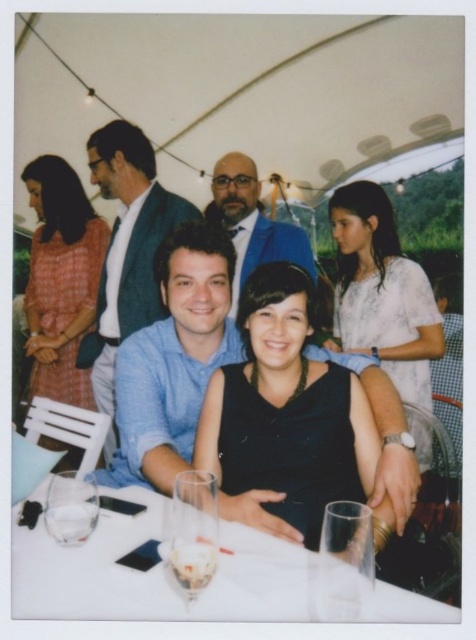
Question: Is clear glassware at center further to the viewer compared to clear glass wine glass at lower left?

Choices:
 (A) yes
 (B) no

Answer: (B)

Question: Which point appears closest to the camera in this image?

Choices:
 (A) (102, 353)
 (B) (57, 513)

Answer: (B)

Question: Which object appears closest to the camera in this image?

Choices:
 (A) black matte dress at center
 (B) clear glass wine glass at lower center
 (C) blue textured suit at center
 (D) transparent glass at lower center

Answer: (D)

Question: Does clear glassware at center appear over clear glass wine glass at lower left?

Choices:
 (A) no
 (B) yes

Answer: (A)

Question: Which point is closer to the camera taking this photo?

Choices:
 (A) [x=57, y=573]
 (B) [x=194, y=552]

Answer: (B)

Question: Is black matte dress at center smaller than clear glass wine glass at lower center?

Choices:
 (A) no
 (B) yes

Answer: (A)